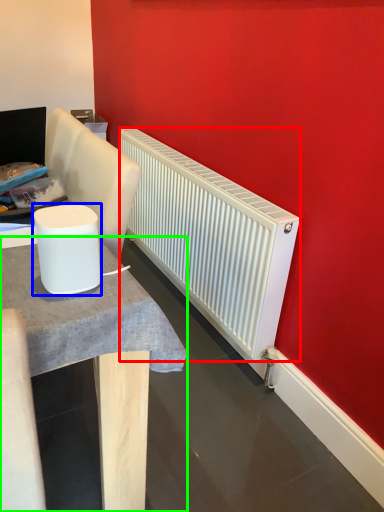
Question: Based on their relative distances, which object is farther from radiator (highlighted by a red box)? Choose from appliance (highlighted by a blue box) and table (highlighted by a green box).

Choices:
 (A) appliance
 (B) table

Answer: (A)